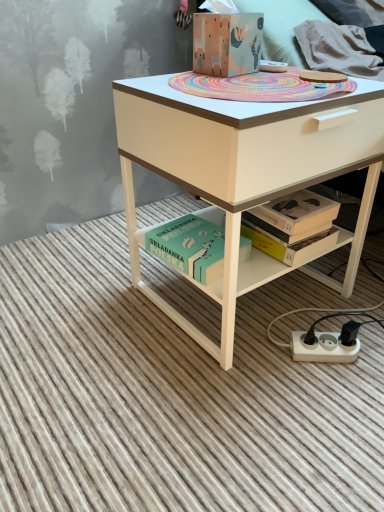
Identify the location of vacant position to the left of matte white desk at center. This screenshot has height=512, width=384. (85, 303).